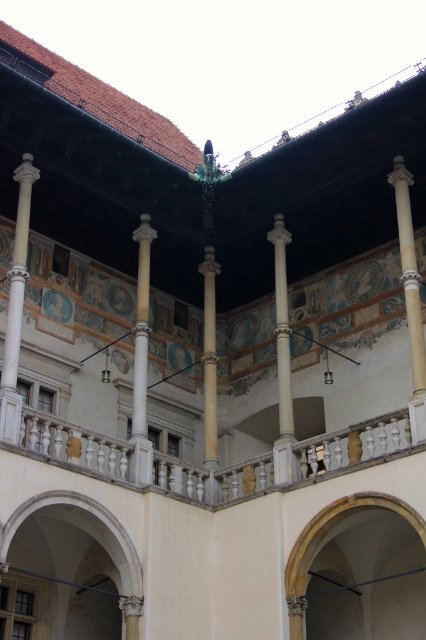
Is point (402, 417) closer to viewer compared to point (325, 515)?

That is True.

Can you confirm if white stone balcony at center is positioned to the right of smooth stone archway at center?

No, white stone balcony at center is not to the right of smooth stone archway at center.

What do you see at coordinates (219, 467) in the screenshot? The width and height of the screenshot is (426, 640). I see `white stone balcony at center` at bounding box center [219, 467].

Identify the location of white stone balcony at center. The width and height of the screenshot is (426, 640). (219, 467).

This screenshot has width=426, height=640. Describe the element at coordinates (325, 534) in the screenshot. I see `smooth stone archway at center` at that location.

Which is in front, point (340, 502) or point (210, 323)?

Point (340, 502) is more forward.

Identify the location of smooth stone archway at center. The image size is (426, 640). (325, 534).

Between point (400, 230) and point (279, 420), which one is positioned behind?

Point (279, 420)

Which is below, white marble column at right or white stone column at center?

white stone column at center is below.

Who is more forward, (408, 212) or (279, 296)?

Point (408, 212)

This screenshot has width=426, height=640. Identify the location of white marble column at right. (411, 298).